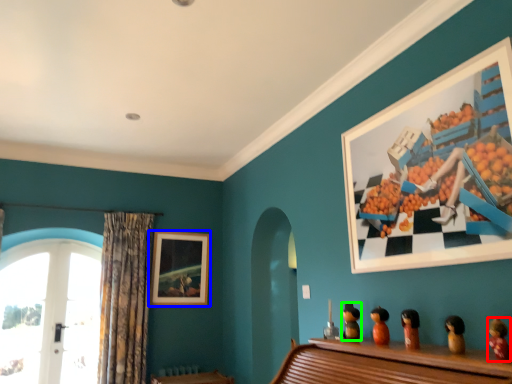
Question: Which object is positioned farthest from toy (highlighted by a red box)? Select from picture frame (highlighted by a blue box) and toy (highlighted by a green box).

Choices:
 (A) picture frame
 (B) toy

Answer: (A)